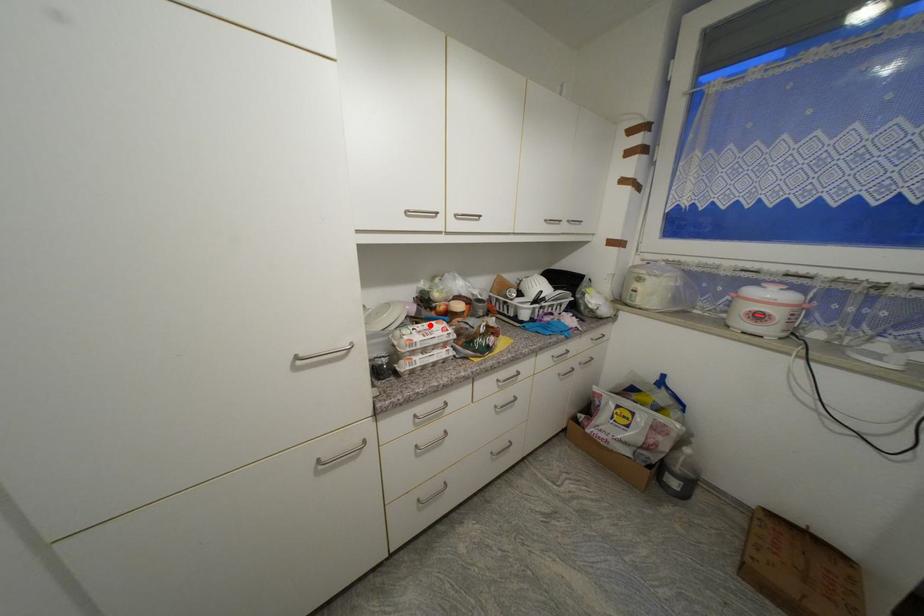
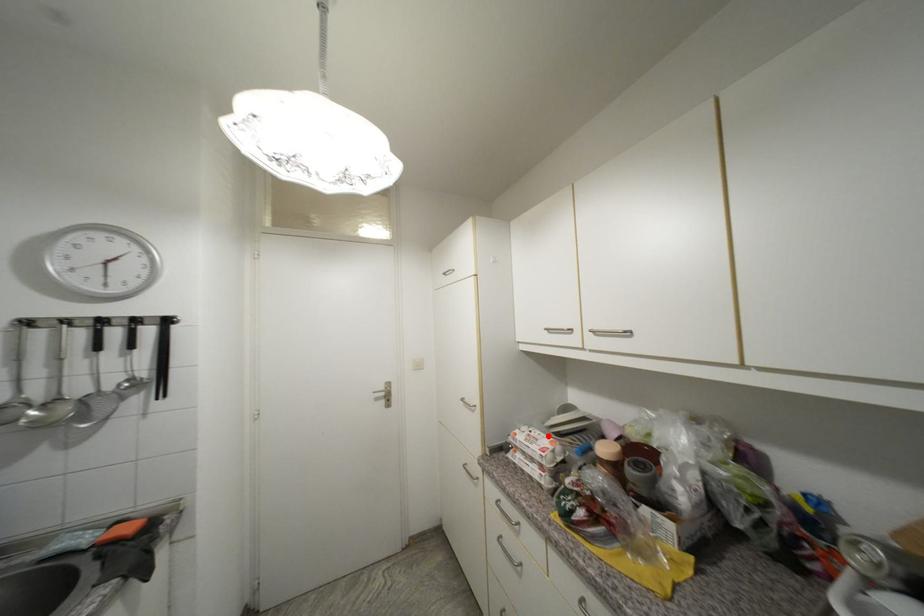
I am providing you with two images of the same scene from different viewpoints. A red point is marked on the first image and another point is marked on the second image. Is the red point in image1 aligned with the point shown in image2?

Yes